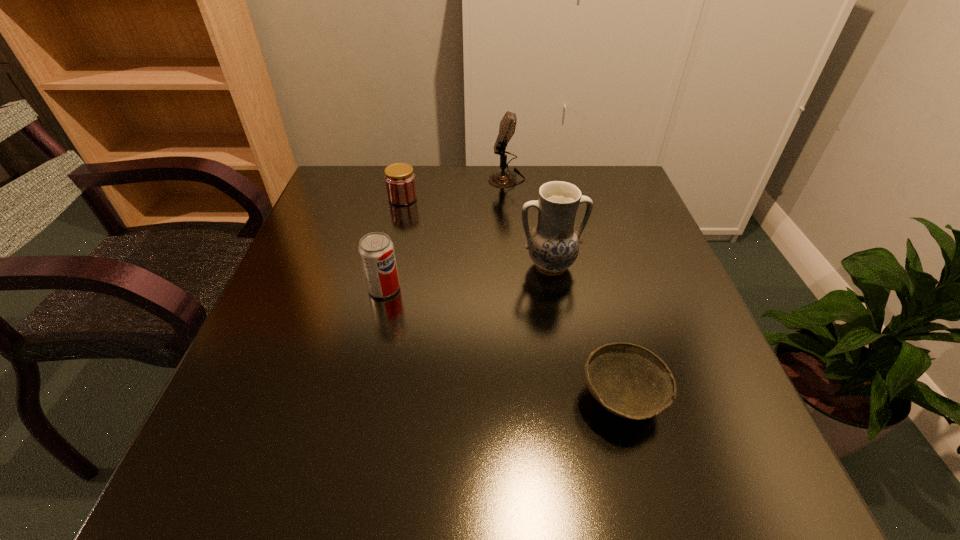
This screenshot has height=540, width=960. In order to click on vacant space at the far left corner of the desktop in this screenshot , I will do `click(378, 180)`.

You are a GUI agent. You are given a task and a screenshot of the screen. Output one action in this format:
    pyautogui.click(x=<x>, y=<y>)
    Task: Click on the free spot at the far right corner of the desktop
    The image size is (960, 540).
    Given the screenshot: What is the action you would take?
    pyautogui.click(x=601, y=193)

In the image, there is a desktop. Where is `vacant space at the near right corner`? Image resolution: width=960 pixels, height=540 pixels. vacant space at the near right corner is located at coordinates 693,487.

Where is `free space that is in between the pottery and the farthest object`? Image resolution: width=960 pixels, height=540 pixels. free space that is in between the pottery and the farthest object is located at coordinates (528, 222).

The height and width of the screenshot is (540, 960). I want to click on free space between the pottery and the farthest object, so click(x=528, y=222).

The width and height of the screenshot is (960, 540). In order to click on free space between the third tallest object and the farthest object in this screenshot , I will do `click(445, 233)`.

Where is `vacant space that is in between the soda and the fourth nearest object`? The height and width of the screenshot is (540, 960). vacant space that is in between the soda and the fourth nearest object is located at coordinates (394, 243).

Find the location of a particular element. free spot between the pottery and the fourth nearest object is located at coordinates (476, 232).

What are the coordinates of `free space between the second shortest object and the nearest object` in the screenshot? It's located at (512, 298).

The height and width of the screenshot is (540, 960). I want to click on free space between the farthest object and the third tallest object, so pyautogui.click(x=445, y=233).